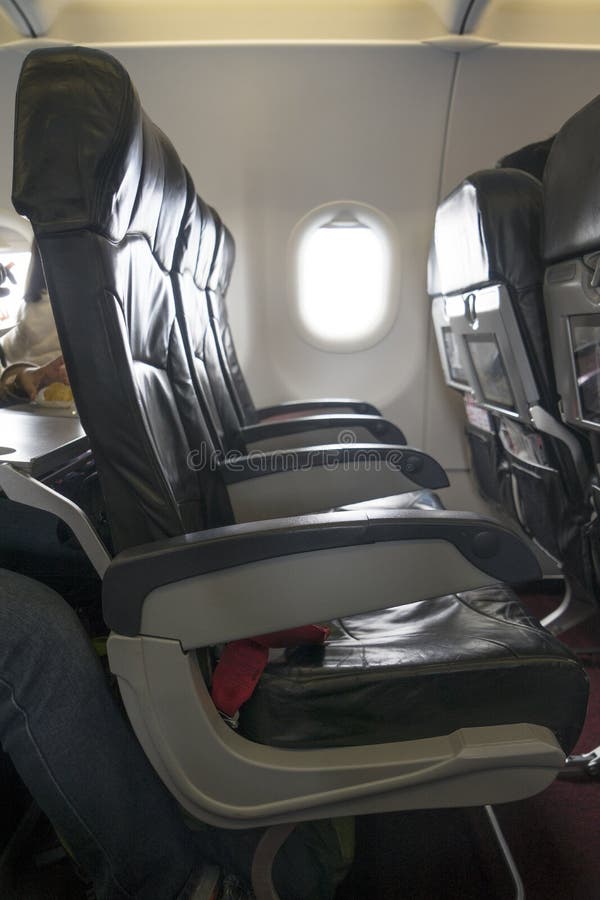
Where is `arm rests`? This screenshot has height=900, width=600. arm rests is located at coordinates (352, 406), (333, 427), (382, 478), (418, 558).